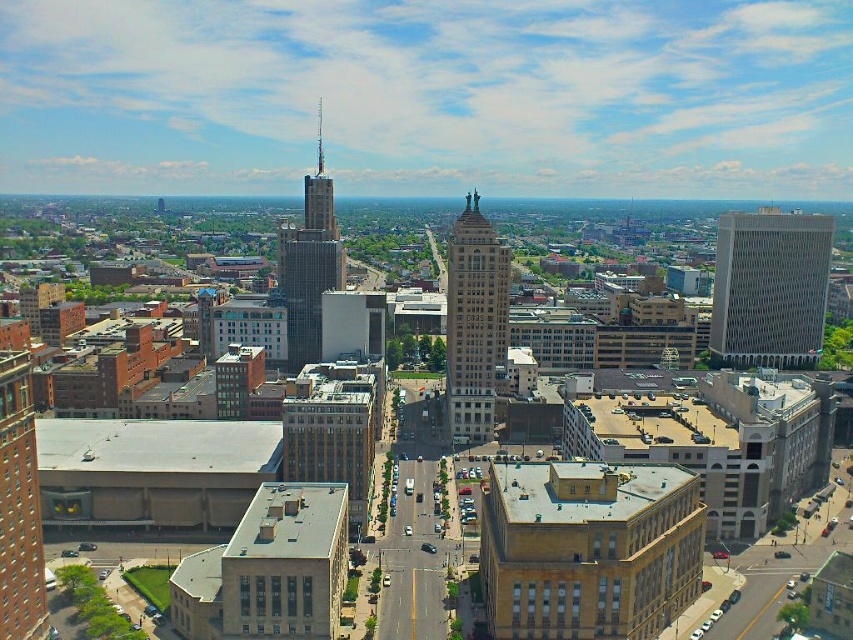
Is white textured building at center-right to the left of brown brick building at lower left from the viewer's perspective?

In fact, white textured building at center-right is to the right of brown brick building at lower left.

Measure the distance between white textured building at center-right and brown brick building at lower left.

white textured building at center-right is 284.83 meters away from brown brick building at lower left.

This screenshot has height=640, width=853. I want to click on white textured building at center-right, so click(769, 289).

Describe the element at coordinates (474, 324) in the screenshot. I see `beige stone tower at center` at that location.

Which is in front, point (477, 401) or point (323, 198)?

Positioned in front is point (477, 401).

Is point (468, 388) positioned behind point (315, 176)?

No, (468, 388) is in front of (315, 176).

Locate an element on the screen. beige stone tower at center is located at coordinates (x=474, y=324).

Does brown brick building at lower left appear over glass skyscraper at center?

No.

Which is in front, point (25, 356) or point (334, 268)?

Point (25, 356) is more forward.

Identify the location of brown brick building at lower left. (19, 506).

Where is `brown brick building at lower left`? The image size is (853, 640). brown brick building at lower left is located at coordinates (19, 506).